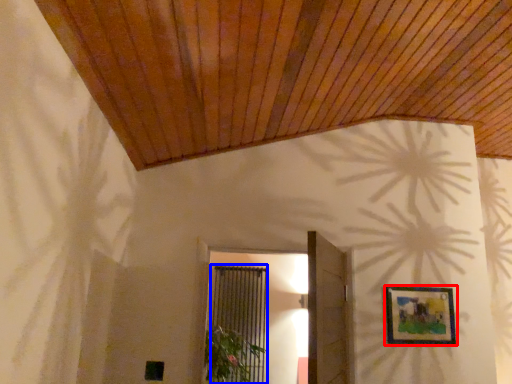
Question: Which point is further to the camera, picture frame (highlighted by a red box) or screen door (highlighted by a blue box)?

Choices:
 (A) picture frame
 (B) screen door

Answer: (B)